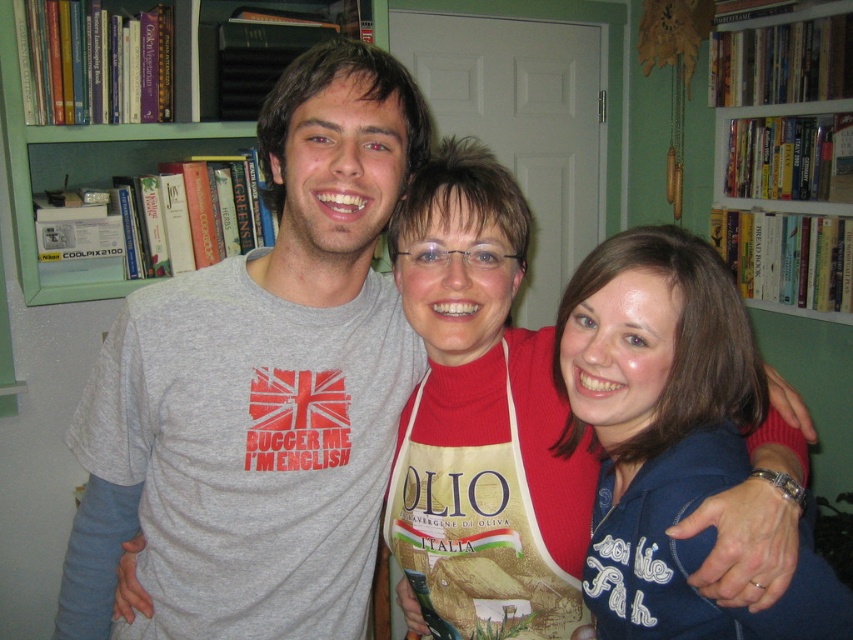
You are standing in the room and want to touch the point at coordinates (260,388). Which person should you approach?

The point at coordinates (260,388) is on the gray t shirt at center, so you should approach the person in the middle wearing the gray T shirt with the red graphic featuring the Union Jack flag and the text